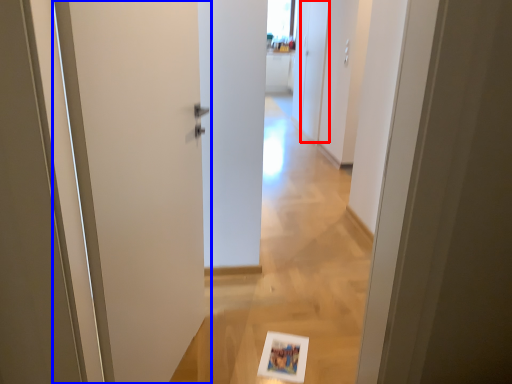
Question: Which object appears closest to the camera in this image, screen door (highlighted by a red box) or door (highlighted by a blue box)?

Choices:
 (A) screen door
 (B) door

Answer: (B)